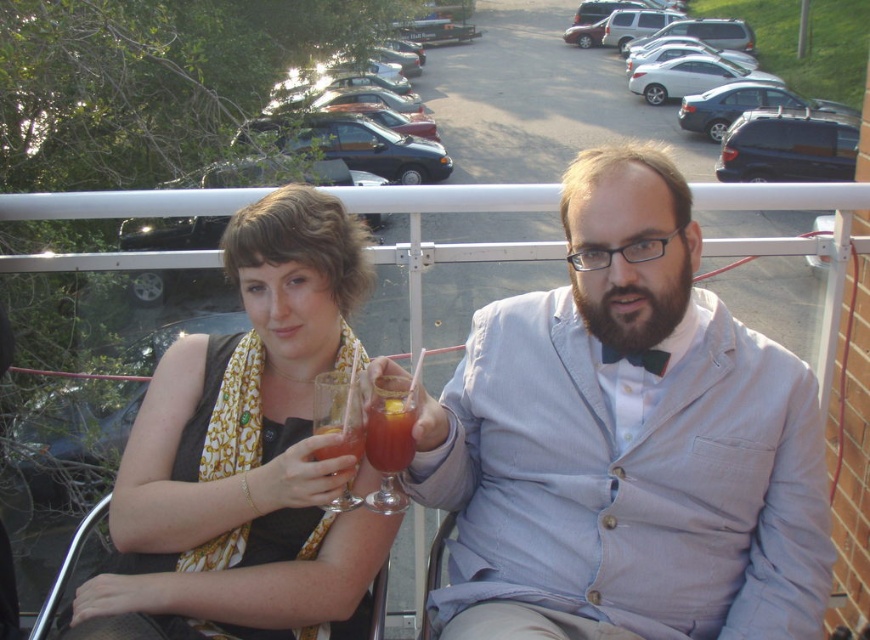
Is light blue cotton shirt at center in front of blue metallic minivan at upper right?

Yes, light blue cotton shirt at center is closer to the viewer.

Is point (820, 525) positioned before point (852, 81)?

Yes.

Image resolution: width=870 pixels, height=640 pixels. I want to click on light blue cotton shirt at center, so click(x=626, y=444).

Who is higher up, shiny black sedan at upper left or translucent glass at center?

shiny black sedan at upper left is higher up.

The width and height of the screenshot is (870, 640). In order to click on shiny black sedan at upper left in this screenshot , I will do `click(273, 173)`.

Between blue metallic minivan at upper right and translucent glass beverage at center, which one is positioned higher?

blue metallic minivan at upper right is above.

Is blue metallic minivan at upper right above translucent glass beverage at center?

Correct, blue metallic minivan at upper right is located above translucent glass beverage at center.

Is point (810, 86) closer to viewer compared to point (342, 444)?

That is False.

This screenshot has width=870, height=640. Identify the location of blue metallic minivan at upper right. (807, 42).